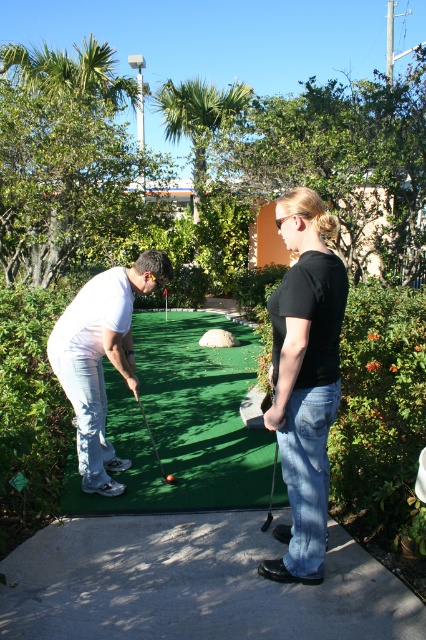
Can you confirm if black cotton shirt at center is positioned to the right of shiny black golf club at center?

Indeed, black cotton shirt at center is positioned on the right side of shiny black golf club at center.

Which of these two, black cotton shirt at center or shiny black golf club at center, stands shorter?

shiny black golf club at center

What do you see at coordinates (305, 380) in the screenshot?
I see `black cotton shirt at center` at bounding box center [305, 380].

You are a GUI agent. You are given a task and a screenshot of the screen. Output one action in this format:
    pyautogui.click(x=<x>, y=<y>)
    Task: Click on the black cotton shirt at center
    This screenshot has width=426, height=640.
    Given the screenshot: What is the action you would take?
    pyautogui.click(x=305, y=380)

Can you confirm if white matte golf club at center is positioned to the right of metallic silver golf club at center?

In fact, white matte golf club at center is to the left of metallic silver golf club at center.

Who is more forward, (98, 358) or (271, 484)?

Positioned in front is point (98, 358).

The image size is (426, 640). I want to click on white matte golf club at center, so click(100, 356).

How far apart are green artificial turf at center and black cotton shirt at center?

A distance of 7.21 feet exists between green artificial turf at center and black cotton shirt at center.

Measure the distance from green artificial turf at center to black cotton shirt at center.

They are 7.21 feet apart.

Who is more forward, (152, 492) or (313, 422)?

Point (313, 422) is more forward.

I want to click on green artificial turf at center, so click(x=181, y=422).